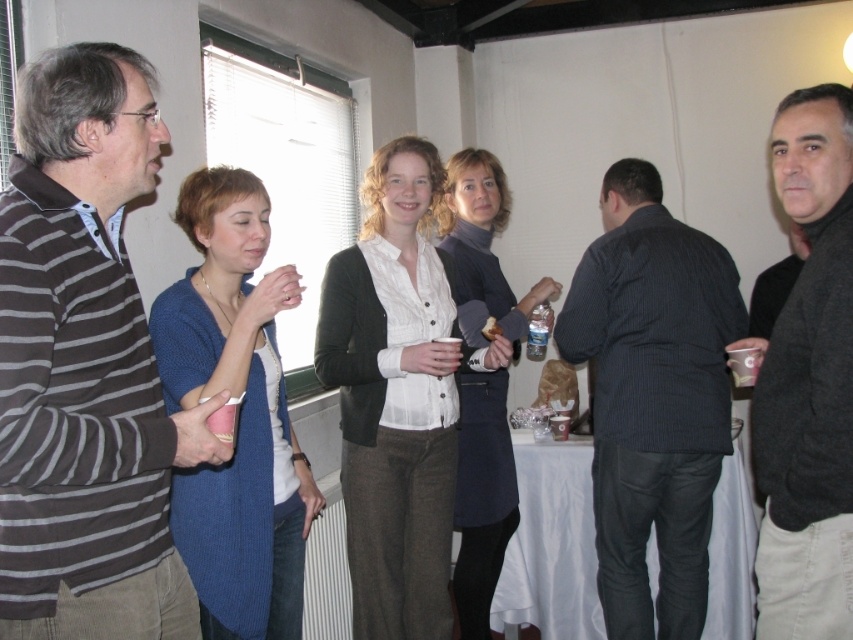
Is matte white blouse at center above matte plastic cup at lower left?

Incorrect, matte white blouse at center is not positioned above matte plastic cup at lower left.

Where is `matte white blouse at center`? matte white blouse at center is located at coordinates (395, 397).

Can you confirm if striped knit sweater at left is smaller than dark gray sweater at center?

Correct, striped knit sweater at left occupies less space than dark gray sweater at center.

Does striped knit sweater at left have a greater width compared to dark gray sweater at center?

In fact, striped knit sweater at left might be narrower than dark gray sweater at center.

Is point (13, 324) positioned behind point (459, 577)?

That is False.

Where is `striped knit sweater at left`? This screenshot has height=640, width=853. striped knit sweater at left is located at coordinates (85, 365).

Who is taller, striped knit sweater at left or blue knitted sweater at center?

With more height is blue knitted sweater at center.

Describe the element at coordinates (85, 365) in the screenshot. The height and width of the screenshot is (640, 853). I see `striped knit sweater at left` at that location.

Is point (115, 52) positioned before point (207, 352)?

Yes, point (115, 52) is closer to viewer.

Where is `striped knit sweater at left`? This screenshot has height=640, width=853. striped knit sweater at left is located at coordinates (85, 365).